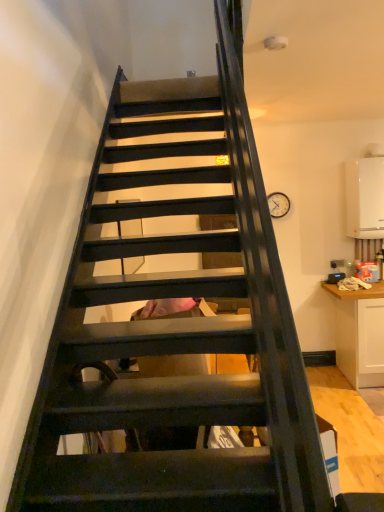
Question: Considering the relative sizes of cardboard box at center and white glossy boiler at upper right in the image provided, is cardboard box at center shorter than white glossy boiler at upper right?

Choices:
 (A) no
 (B) yes

Answer: (B)

Question: Is cardboard box at center wider than white glossy boiler at upper right?

Choices:
 (A) yes
 (B) no

Answer: (B)

Question: Is cardboard box at center facing towards white glossy boiler at upper right?

Choices:
 (A) no
 (B) yes

Answer: (A)

Question: From a real-world perspective, is cardboard box at center located beneath white glossy boiler at upper right?

Choices:
 (A) yes
 (B) no

Answer: (A)

Question: Is cardboard box at center oriented away from white glossy boiler at upper right?

Choices:
 (A) no
 (B) yes

Answer: (A)

Question: From the image's perspective, is cardboard box at center under white glossy boiler at upper right?

Choices:
 (A) no
 (B) yes

Answer: (B)

Question: Considering the relative sizes of white glossy boiler at upper right and cardboard box at center in the image provided, is white glossy boiler at upper right shorter than cardboard box at center?

Choices:
 (A) yes
 (B) no

Answer: (B)

Question: Considering the relative sizes of white glossy boiler at upper right and cardboard box at center in the image provided, is white glossy boiler at upper right taller than cardboard box at center?

Choices:
 (A) yes
 (B) no

Answer: (A)

Question: Is white glossy boiler at upper right positioned before cardboard box at center?

Choices:
 (A) no
 (B) yes

Answer: (A)

Question: From the image's perspective, would you say white glossy boiler at upper right is shown under cardboard box at center?

Choices:
 (A) yes
 (B) no

Answer: (B)

Question: Does white glossy boiler at upper right appear on the left side of cardboard box at center?

Choices:
 (A) no
 (B) yes

Answer: (A)

Question: Is white glossy boiler at upper right to the right of cardboard box at center from the viewer's perspective?

Choices:
 (A) yes
 (B) no

Answer: (A)

Question: In terms of size, does white glossy boiler at upper right appear bigger or smaller than cardboard box at center?

Choices:
 (A) small
 (B) big

Answer: (B)